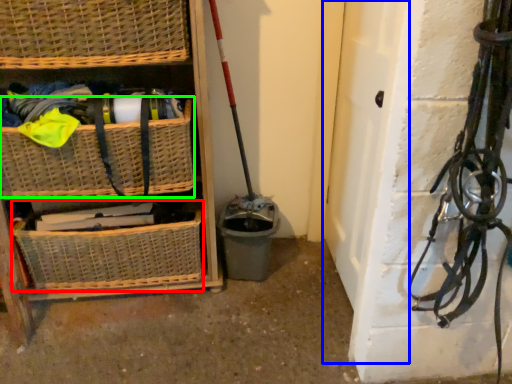
Question: Which is nearer to the basket (highlighted by a red box)? door (highlighted by a blue box) or basket (highlighted by a green box).

Choices:
 (A) door
 (B) basket

Answer: (B)